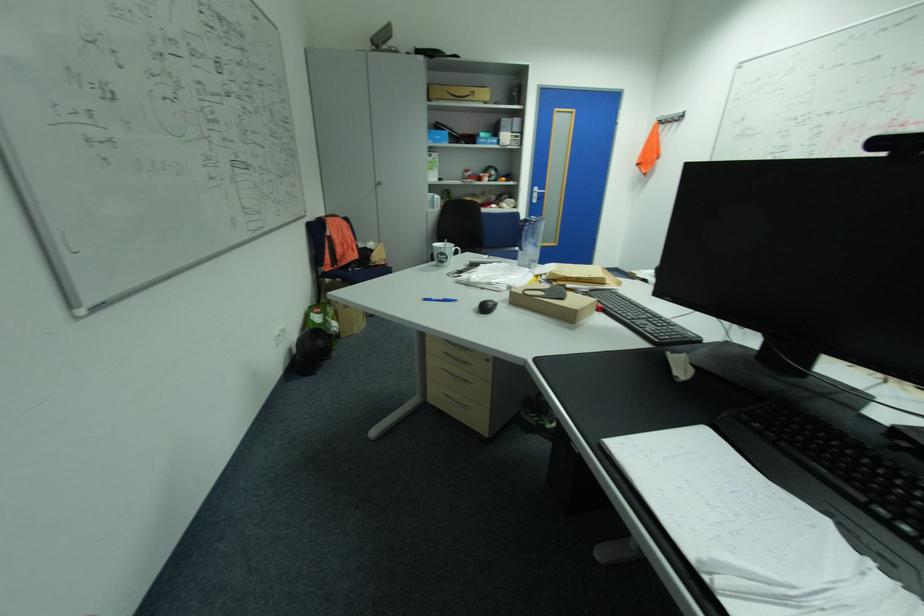
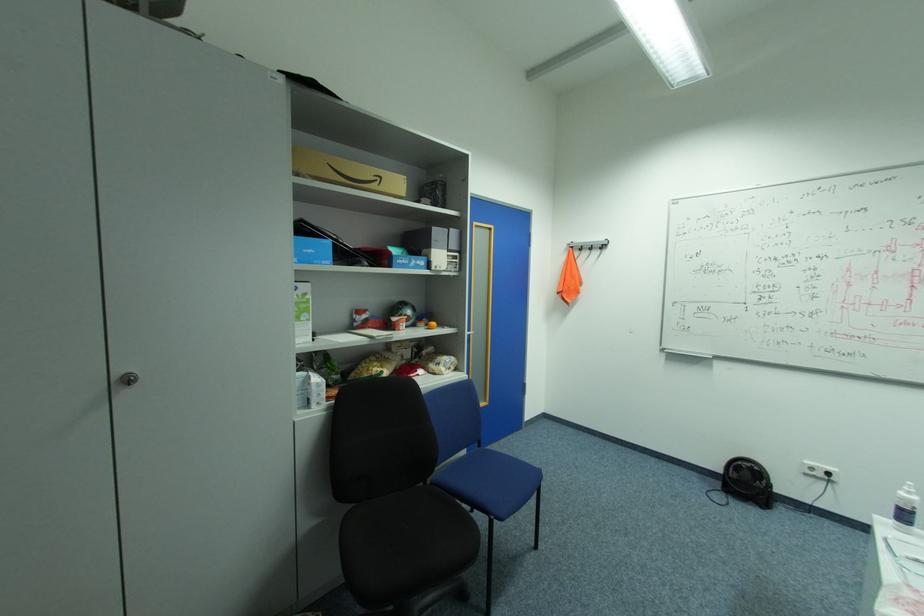
Locate, in the second image, the point that corresponds to point 386,184 in the first image.

(137, 379)